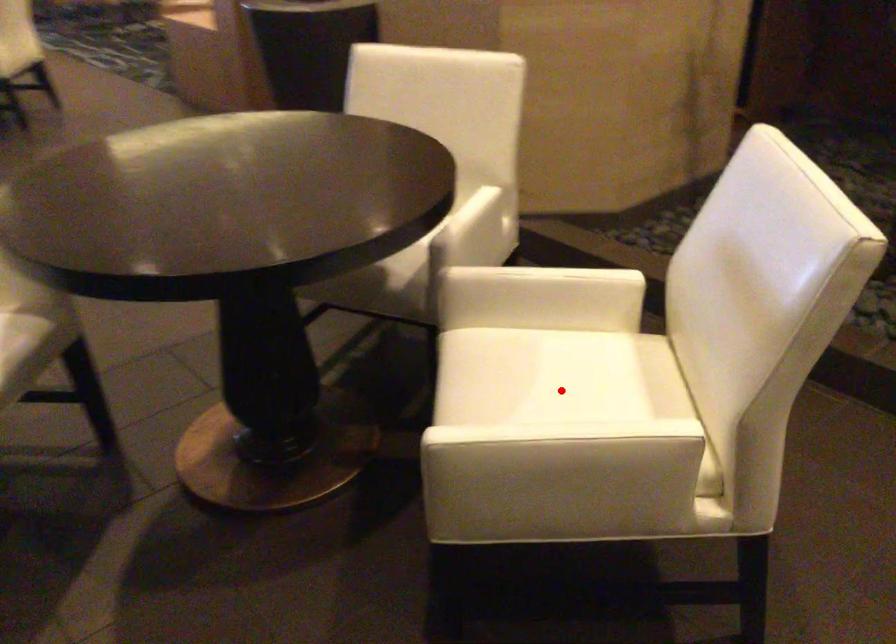
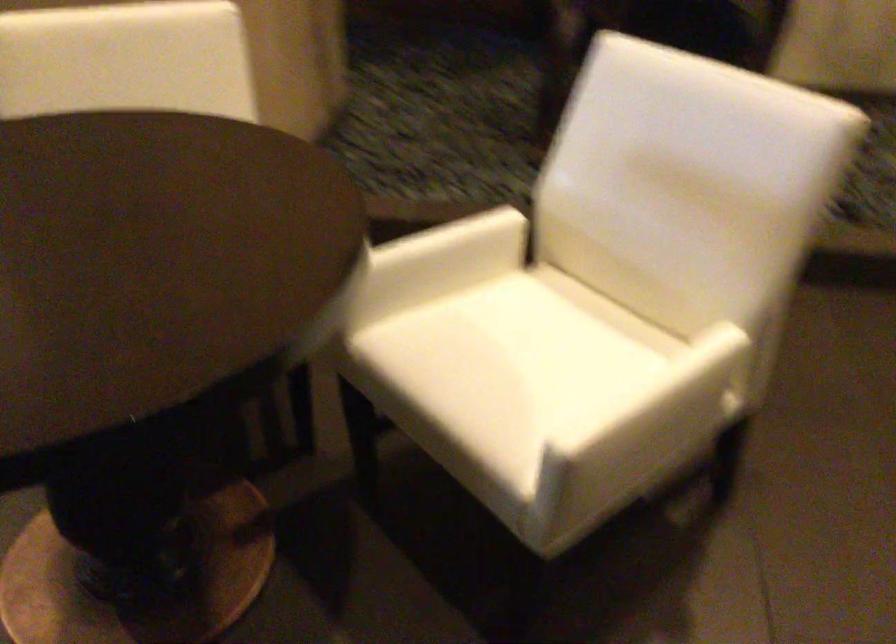
In the second image, find the point that corresponds to the highlighted location in the first image.

(533, 348)